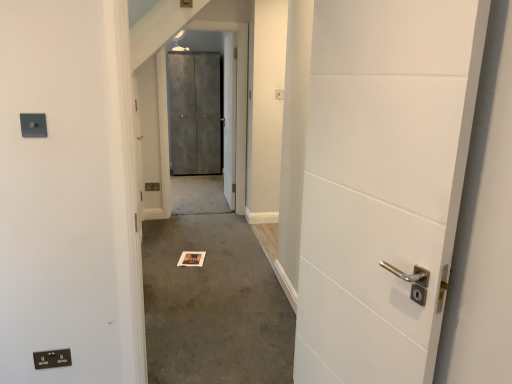
Question: Does black plastic electric outlet at lower left, the first electric outlet when ordered from back to front, have a lesser height compared to matte gray electric outlet at upper left, the 2th electric outlet in the back-to-front sequence?

Choices:
 (A) yes
 (B) no

Answer: (B)

Question: Would you consider black plastic electric outlet at lower left, marked as the 2th electric outlet in a top-to-bottom arrangement, to be distant from matte gray electric outlet at upper left, the 1th electric outlet positioned from the front?

Choices:
 (A) yes
 (B) no

Answer: (B)

Question: Can you confirm if black plastic electric outlet at lower left, which ranks as the 2th electric outlet in front-to-back order, is taller than matte gray electric outlet at upper left, the 1th electric outlet positioned from the front?

Choices:
 (A) no
 (B) yes

Answer: (B)

Question: Is black plastic electric outlet at lower left, marked as the 2th electric outlet in a top-to-bottom arrangement, facing towards matte gray electric outlet at upper left, the 2th electric outlet in the back-to-front sequence?

Choices:
 (A) yes
 (B) no

Answer: (B)

Question: Does black plastic electric outlet at lower left, marked as the 2th electric outlet in a top-to-bottom arrangement, have a lesser width compared to matte gray electric outlet at upper left, the 2th electric outlet in the back-to-front sequence?

Choices:
 (A) yes
 (B) no

Answer: (A)

Question: From the image's perspective, relative to black plastic electric outlet at lower left, marked as the 2th electric outlet in a top-to-bottom arrangement, is carpeted floor at center above or below?

Choices:
 (A) above
 (B) below

Answer: (A)

Question: Looking at the image, does carpeted floor at center seem bigger or smaller compared to black plastic electric outlet at lower left, marked as the 1th electric outlet in a bottom-to-top arrangement?

Choices:
 (A) small
 (B) big

Answer: (B)

Question: Would you say carpeted floor at center is inside or outside black plastic electric outlet at lower left, marked as the 1th electric outlet in a bottom-to-top arrangement?

Choices:
 (A) outside
 (B) inside

Answer: (A)

Question: In terms of width, does carpeted floor at center look wider or thinner when compared to black plastic electric outlet at lower left, marked as the 1th electric outlet in a bottom-to-top arrangement?

Choices:
 (A) thin
 (B) wide

Answer: (B)

Question: Visually, is metallic gray elevator door at center positioned to the left or to the right of black plastic electric outlet at lower left, marked as the 1th electric outlet in a bottom-to-top arrangement?

Choices:
 (A) right
 (B) left

Answer: (A)

Question: From their relative heights in the image, would you say metallic gray elevator door at center is taller or shorter than black plastic electric outlet at lower left, marked as the 1th electric outlet in a bottom-to-top arrangement?

Choices:
 (A) tall
 (B) short

Answer: (A)

Question: Is metallic gray elevator door at center in front of or behind black plastic electric outlet at lower left, which ranks as the 2th electric outlet in front-to-back order, in the image?

Choices:
 (A) behind
 (B) front

Answer: (A)

Question: In terms of width, does metallic gray elevator door at center look wider or thinner when compared to black plastic electric outlet at lower left, which ranks as the 2th electric outlet in front-to-back order?

Choices:
 (A) thin
 (B) wide

Answer: (B)

Question: Looking at their shapes, would you say matte gray electric outlet at upper left, which is the 1th electric outlet from top to bottom, is wider or thinner than carpeted floor at center?

Choices:
 (A) wide
 (B) thin

Answer: (B)

Question: From a real-world perspective, is matte gray electric outlet at upper left, the 1th electric outlet positioned from the front, physically located above or below carpeted floor at center?

Choices:
 (A) above
 (B) below

Answer: (A)